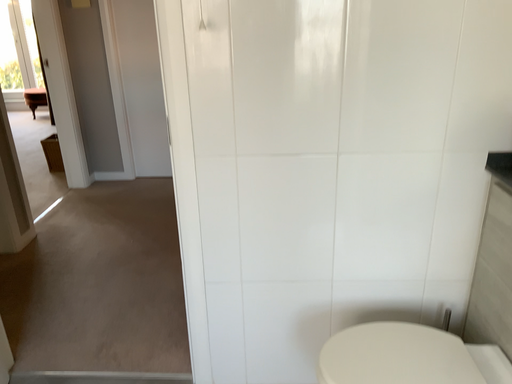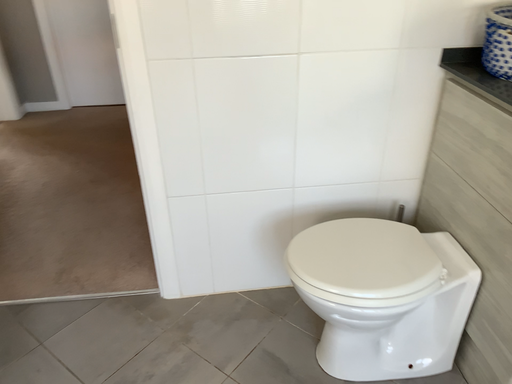
Question: Which way did the camera rotate in the video?

Choices:
 (A) rotated upward
 (B) rotated downward

Answer: (B)